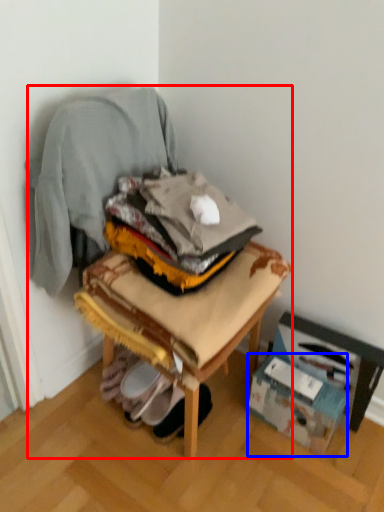
Question: Among these objects, which one is farthest to the camera, chair (highlighted by a red box) or cardboard box (highlighted by a blue box)?

Choices:
 (A) chair
 (B) cardboard box

Answer: (B)